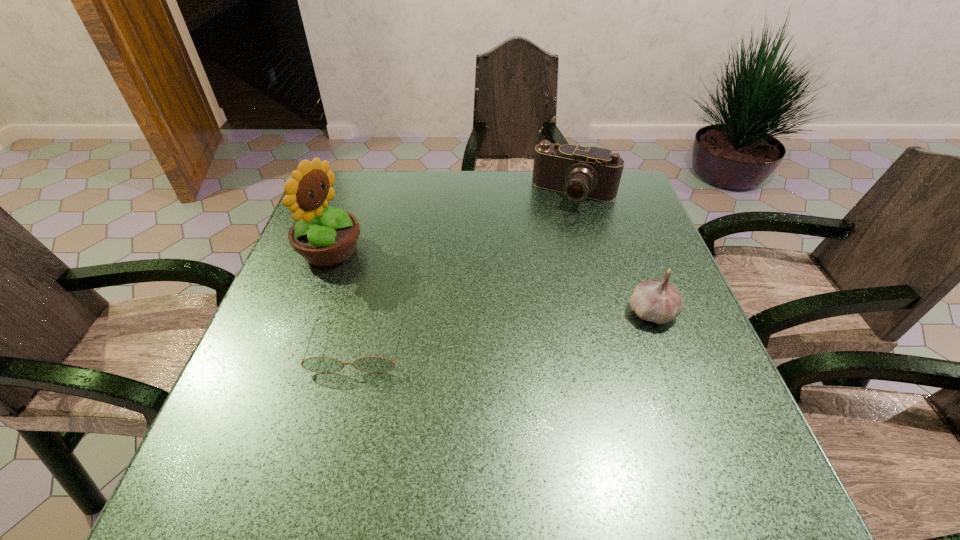
Where is `blank space at the left edge of the desktop`? blank space at the left edge of the desktop is located at coordinates (345, 271).

What are the coordinates of `vacant space at the right edge of the desktop` in the screenshot? It's located at click(x=623, y=233).

Locate an element on the screen. free space at the far left corner is located at coordinates (342, 187).

Locate an element on the screen. vacant space at the near left corner of the desktop is located at coordinates (224, 437).

Locate an element on the screen. Image resolution: width=960 pixels, height=540 pixels. vacant position at the near right corner of the desktop is located at coordinates (710, 423).

You are a GUI agent. You are given a task and a screenshot of the screen. Output one action in this format:
    pyautogui.click(x=<x>, y=<y>)
    Task: Click on the free space that is in between the sunglasses and the garlic
    
    Given the screenshot: What is the action you would take?
    pyautogui.click(x=505, y=329)

The height and width of the screenshot is (540, 960). Identify the location of free point between the camera and the sunglasses. (467, 270).

Image resolution: width=960 pixels, height=540 pixels. In order to click on empty location between the garlic and the sunglasses in this screenshot , I will do `click(505, 329)`.

This screenshot has width=960, height=540. Identify the location of blank region between the garlic and the sunglasses. [505, 329].

Where is `free spot between the tallest object and the garlic`? free spot between the tallest object and the garlic is located at coordinates (491, 281).